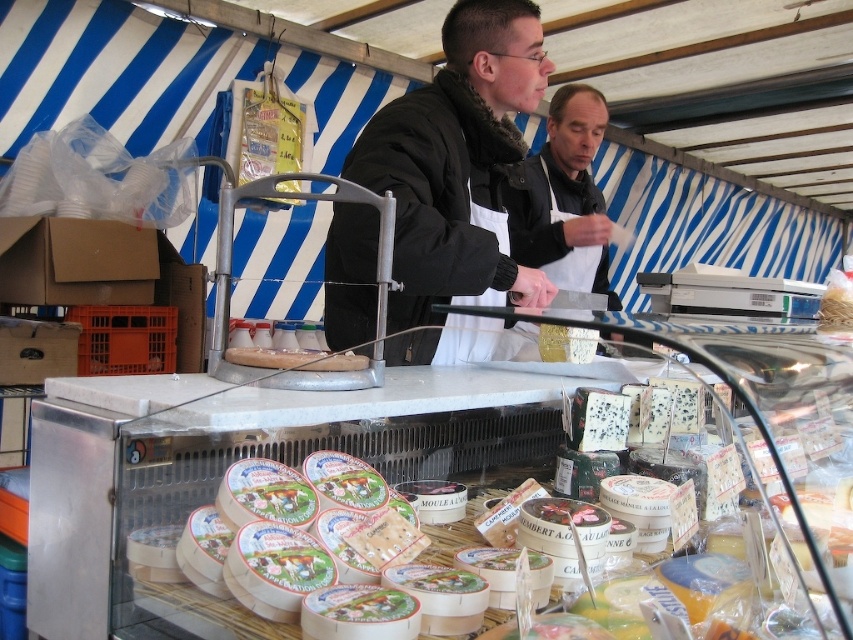
Question: Observing the image, what is the correct spatial positioning of white creamy cheese at center in reference to black matte jacket at center?

Choices:
 (A) right
 (B) left

Answer: (A)

Question: Which point is farther from the camera taking this photo?

Choices:
 (A) (317, 442)
 (B) (466, 285)

Answer: (B)

Question: Among these objects, which one is farthest from the camera?

Choices:
 (A) white creamy cheese at center
 (B) black matte jacket at center

Answer: (B)

Question: Does white creamy cheese at center appear under black matte jacket at center?

Choices:
 (A) yes
 (B) no

Answer: (A)

Question: Can you confirm if white creamy cheese at center is smaller than black matte jacket at center?

Choices:
 (A) no
 (B) yes

Answer: (B)